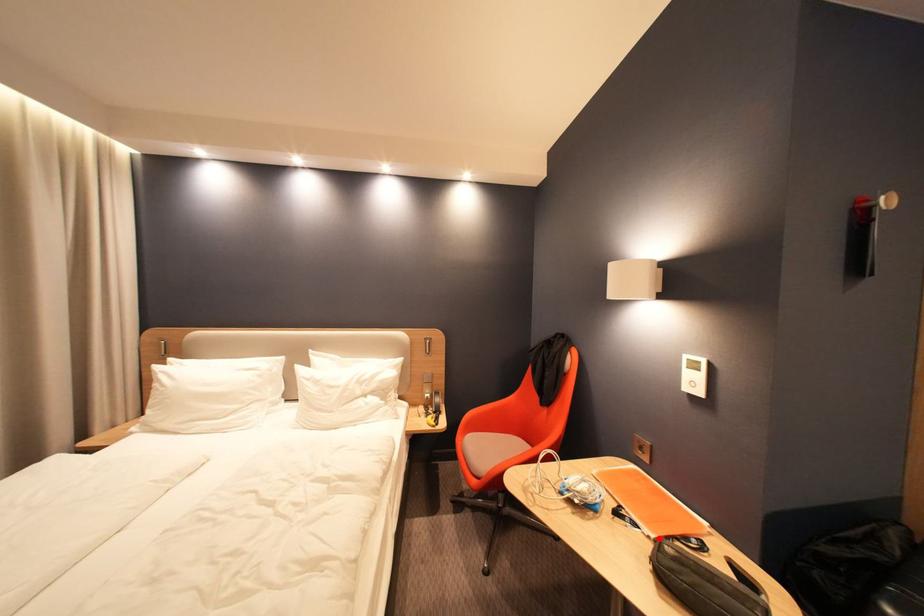
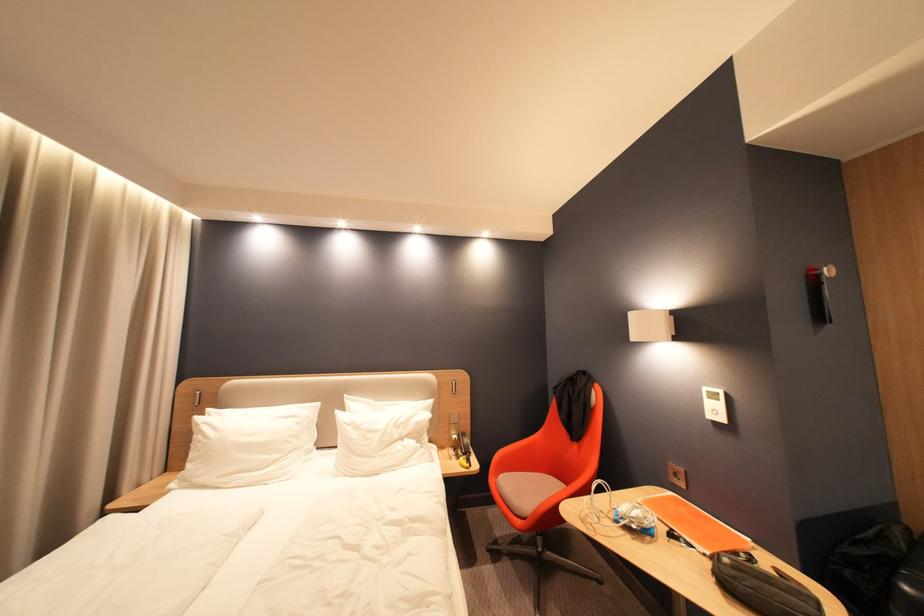
Question: I am providing you with two images of the same scene from different viewpoints. A red point is marked on the first image. Is the red point's position out of view in image 2?

Choices:
 (A) Yes
 (B) No

Answer: (B)